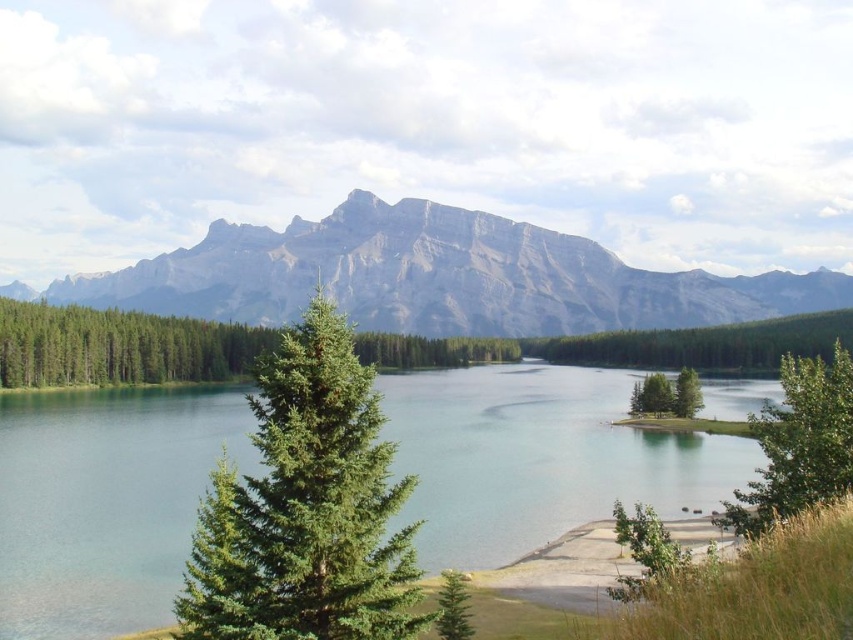
Question: Does clear water at center have a greater width compared to green needle-like tree at center?

Choices:
 (A) no
 (B) yes

Answer: (B)

Question: Is clear water at center smaller than green matte tree at center?

Choices:
 (A) yes
 (B) no

Answer: (B)

Question: Among these points, which one is nearest to the camera?

Choices:
 (A) (689, 378)
 (B) (804, 394)

Answer: (B)

Question: Among these points, which one is nearest to the camera?

Choices:
 (A) (825, 458)
 (B) (527, 492)
 (C) (640, 397)

Answer: (A)

Question: Estimate the real-world distances between objects in this image. Which object is farther from the green matte tree at right?

Choices:
 (A) gray rocky mountain at upper center
 (B) green needle-like tree at center

Answer: (A)

Question: Does green matte tree at right have a smaller size compared to green matte tree at center?

Choices:
 (A) yes
 (B) no

Answer: (B)